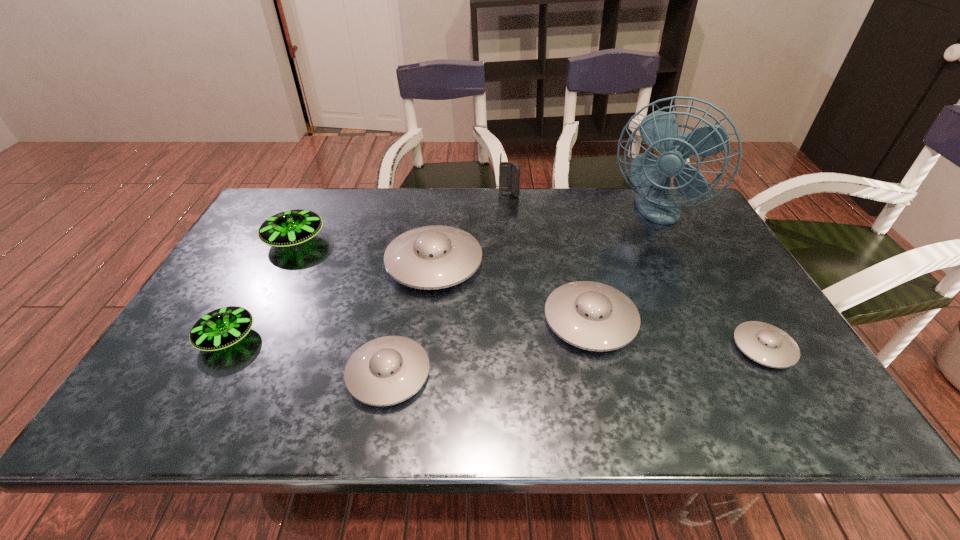
Locate an element on the screen. vacant region between the second tallest object and the rightmost saucer is located at coordinates (636, 271).

Where is `vacant space that is in between the farther green saucer and the biggest gray saucer`? vacant space that is in between the farther green saucer and the biggest gray saucer is located at coordinates (365, 252).

Locate an element on the screen. free spot between the tallest object and the smallest gray saucer is located at coordinates (708, 280).

Identify which object is located as the sixth nearest to the bigger green saucer. Please provide its 2D coordinates. Your answer should be formatted as a tuple, i.e. [(x, y)], where the tuple contains the x and y coordinates of a point satisfying the conditions above.

[(659, 130)]

Identify which object is the fifth closest to the tallest object. Please provide its 2D coordinates. Your answer should be formatted as a tuple, i.e. [(x, y)], where the tuple contains the x and y coordinates of a point satisfying the conditions above.

[(388, 370)]

Image resolution: width=960 pixels, height=540 pixels. Find the location of `the closest saucer to the biggest gray saucer`. the closest saucer to the biggest gray saucer is located at coordinates (593, 316).

Find the location of a particular element. This screenshot has height=540, width=960. saucer that is the fifth closest to the fan is located at coordinates (289, 228).

Find the location of a particular element. gray saucer that is the third closest to the third gray saucer from left to right is located at coordinates (388, 370).

The image size is (960, 540). Identify the location of gray saucer that stands as the second closest to the third gray saucer from left to right. (768, 345).

Image resolution: width=960 pixels, height=540 pixels. What are the coordinates of `vacant space that satisfies the following two spatial constraints: 1. on the back side of the second smallest gray saucer; 2. on the left side of the biggest gray saucer` in the screenshot? It's located at (409, 263).